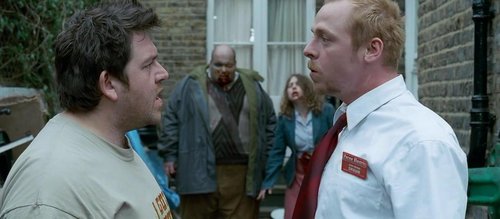
Find the location of a particular element. The image size is (500, 219). windows is located at coordinates (235, 26), (279, 21).